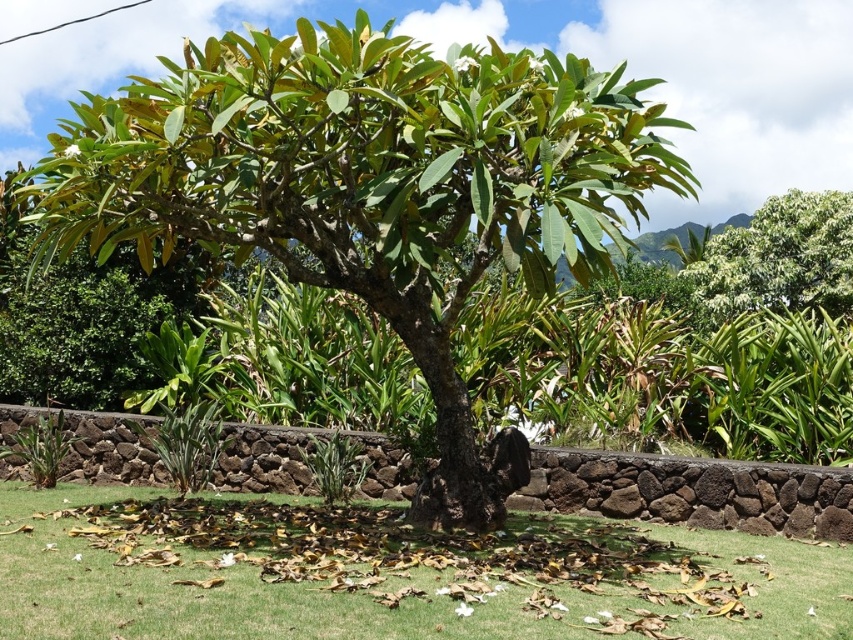
From the picture: Can you confirm if green leafy tree at center is positioned below green leafy tree at upper right?

Yes.

Which is behind, point (473, 476) or point (834, 289)?

The point (834, 289) is more distant.

Between point (583, 74) and point (735, 257), which one is positioned in front?

Positioned in front is point (583, 74).

Locate an element on the screen. This screenshot has width=853, height=640. green leafy tree at center is located at coordinates (370, 188).

Does green grass at center have a lesser width compared to green leafy tree at upper right?

Yes, green grass at center is thinner than green leafy tree at upper right.

Is green grass at center below green leafy tree at upper right?

Yes.

Between point (610, 572) and point (850, 294), which one is positioned behind?

The point (850, 294) is behind.

The image size is (853, 640). Find the location of `green grass at center`. green grass at center is located at coordinates (395, 576).

Looking at this image, measure the distance from green leafy tree at center to green grass at center.

green leafy tree at center is 4.38 meters away from green grass at center.

Does green leafy tree at center appear over green grass at center?

Indeed, green leafy tree at center is positioned over green grass at center.

Between point (456, 186) and point (86, 545), which one is positioned in front?

Positioned in front is point (86, 545).

The height and width of the screenshot is (640, 853). Identify the location of green leafy tree at center. (370, 188).